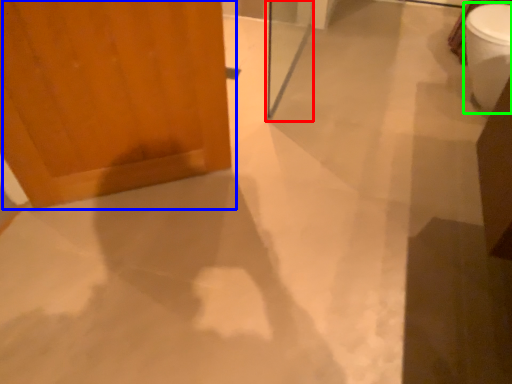
Question: Considering the real-world distances, which object is farthest from screen door (highlighted by a red box)? door (highlighted by a blue box) or toilet bowl (highlighted by a green box)?

Choices:
 (A) door
 (B) toilet bowl

Answer: (B)